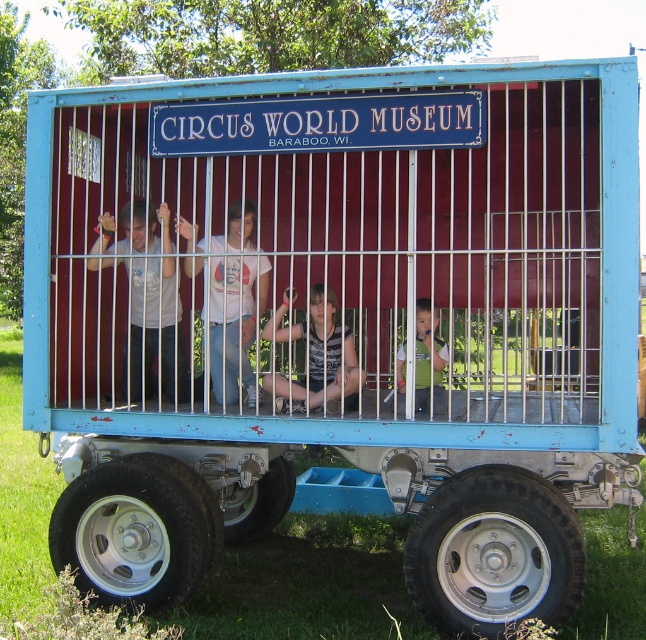
Does matte white shirt at center have a greater width compared to white cotton t-shirt at center?

Correct, the width of matte white shirt at center exceeds that of white cotton t-shirt at center.

Can you confirm if matte white shirt at center is thinner than white cotton t-shirt at center?

Incorrect, matte white shirt at center's width is not less than white cotton t-shirt at center's.

Find the location of `matte white shirt at center`. matte white shirt at center is located at coordinates (147, 298).

Does matte white shirt at center appear on the right side of light blue plastic child at center?

Incorrect, matte white shirt at center is not on the right side of light blue plastic child at center.

Does point (143, 225) come in front of point (419, 340)?

No, (143, 225) is further to viewer.

Is point (130, 358) farther from camera compared to point (419, 371)?

Yes, point (130, 358) is farther from viewer.

Locate an element on the screen. The image size is (646, 640). matte white shirt at center is located at coordinates (147, 298).

Can you confirm if white cotton t-shirt at center is thinner than light brown wooden chair at center?

Indeed, white cotton t-shirt at center has a lesser width compared to light brown wooden chair at center.

Does white cotton t-shirt at center have a smaller size compared to light brown wooden chair at center?

Incorrect, white cotton t-shirt at center is not smaller in size than light brown wooden chair at center.

Locate an element on the screen. white cotton t-shirt at center is located at coordinates [234, 323].